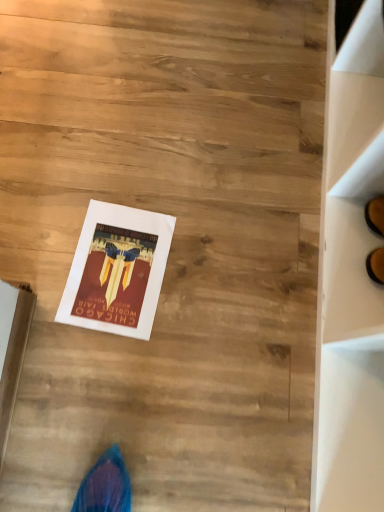
Locate an element on the screen. vacant space that is in between white cardboard box at lower left and matte paper poster at center is located at coordinates (59, 358).